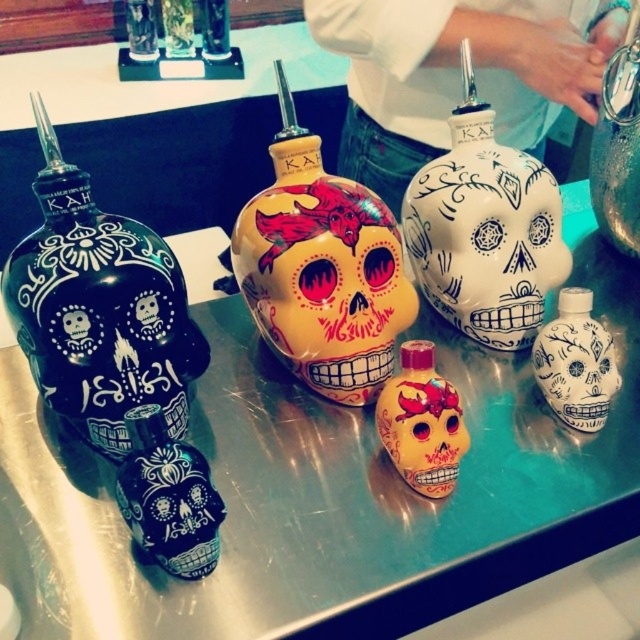
You are a collector examining the tequila bottles displayed on the metallic surface. You need to reach for the yellow matte skull at center and the matte red skull at center. Which one should you grab first to avoid knocking over the other?

You should grab the yellow matte skull at center first because it is closer to you than the matte red skull at center, so reaching for it first reduces the risk of disturbing the other bottle.

You are a collector who wants to place both the matte red skull at center and the white glossy skull at lower right on a shelf. The shelf has limited space, and you need to know which one takes up more space. Which skull requires more shelf space?

The matte red skull at center is larger in size than the white glossy skull at lower right, so it requires more shelf space.

You are a customer at a liquor store and want to buy a tequila bottle. You see the matte black skull at left and the white glossy skull at lower right. Which one is positioned farther to the right?

The white glossy skull at lower right is positioned farther to the right than the matte black skull at left.